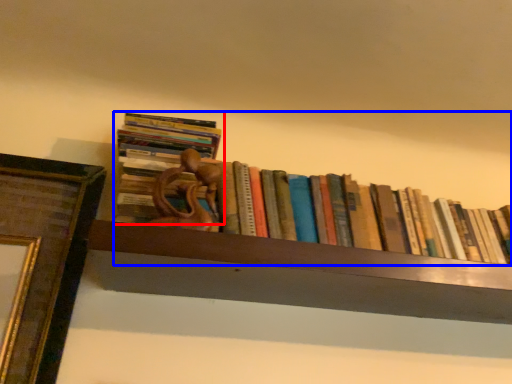
Question: Among these objects, which one is nearest to the camera, book (highlighted by a red box) or book (highlighted by a blue box)?

Choices:
 (A) book
 (B) book

Answer: (A)